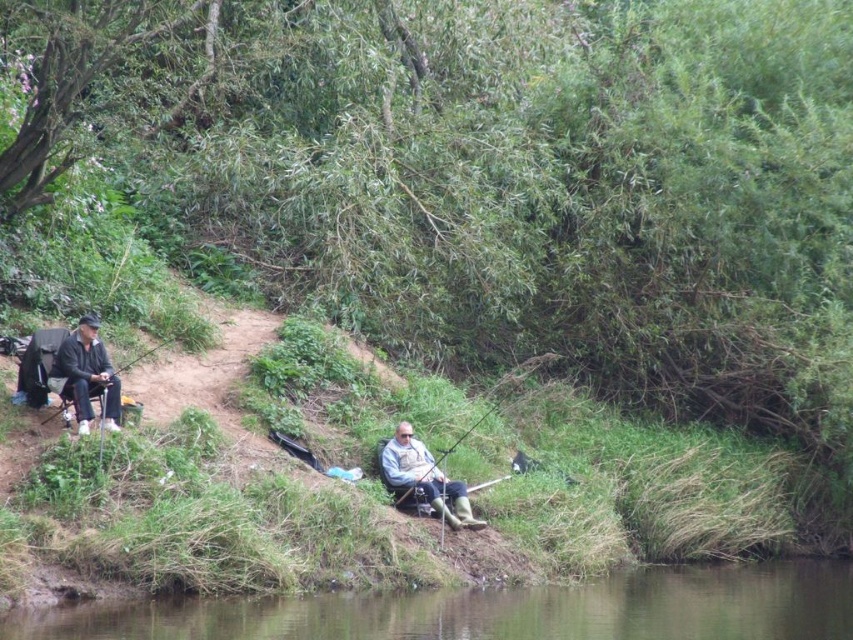
Question: Is matte black jacket at left to the right of light gray fabric jacket at center from the viewer's perspective?

Choices:
 (A) yes
 (B) no

Answer: (B)

Question: Can you confirm if matte black jacket at left is wider than matte black fishing rod at left?

Choices:
 (A) no
 (B) yes

Answer: (A)

Question: Is matte black jacket at left smaller than light gray fabric jacket at center?

Choices:
 (A) yes
 (B) no

Answer: (A)

Question: Which object is the closest to the light gray fabric jacket at center?

Choices:
 (A) matte black jacket at left
 (B) green grass at lower center

Answer: (B)

Question: Based on their relative distances, which object is farther from the green grass at lower center?

Choices:
 (A) matte black jacket at left
 (B) matte black fishing rod at left

Answer: (B)

Question: Which point is farther to the camera?

Choices:
 (A) light gray fabric jacket at center
 (B) green grass at lower center
 (C) matte black fishing rod at left
 (D) matte black jacket at left

Answer: (A)